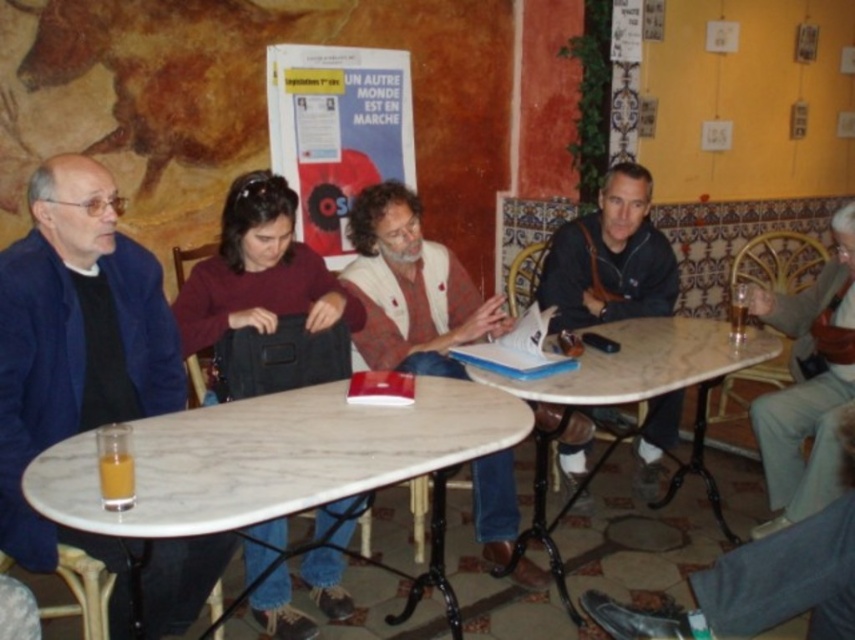
Looking at this image, which is above, blue woolen jacket at left or matte paper poster at center?

matte paper poster at center

Between blue woolen jacket at left and matte paper poster at center, which one appears on the left side from the viewer's perspective?

blue woolen jacket at left is more to the left.

Which is in front, point (157, 589) or point (382, 177)?

Point (157, 589)

The width and height of the screenshot is (855, 640). I want to click on blue woolen jacket at left, so click(77, 349).

Is point (22, 548) positioned in front of point (111, 474)?

No, (22, 548) is behind (111, 474).

Between point (157, 593) and point (133, 488), which one is positioned in front?

Point (133, 488)

Who is more distant from viewer, [52,257] or [109,460]?

Point [52,257]

Find the location of a particular element. The image size is (855, 640). blue woolen jacket at left is located at coordinates (77, 349).

Based on the photo, measure the distance between white marble table at center and translucent glass beverage at table left.

They are 17.49 inches apart.

Can you confirm if white marble table at center is smaller than translucent glass beverage at table left?

No, white marble table at center is not smaller than translucent glass beverage at table left.

I want to click on white marble table at center, so pos(273,456).